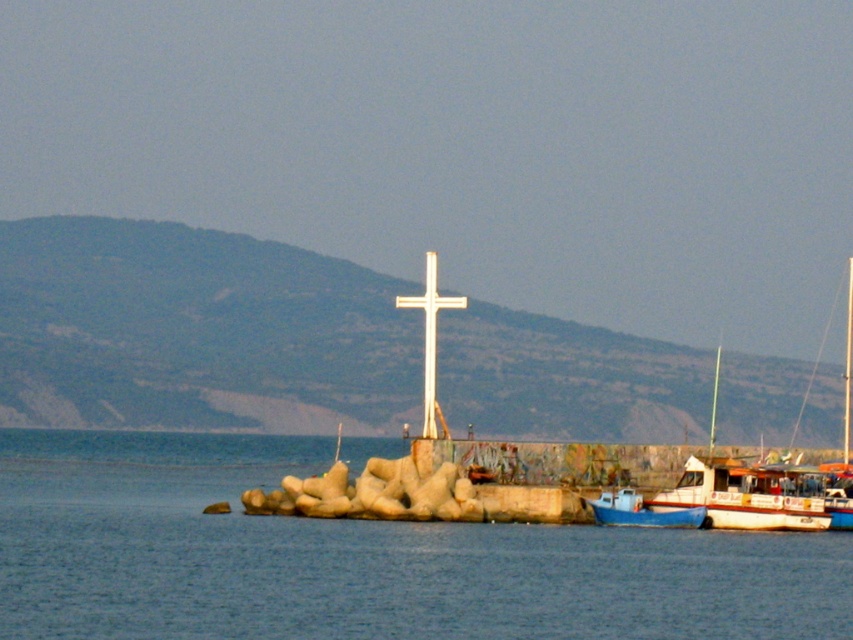
Question: Does white metallic cross at center have a smaller size compared to blue matte boat at lower right?

Choices:
 (A) yes
 (B) no

Answer: (B)

Question: Which of the following is the closest to the observer?

Choices:
 (A) (296, 456)
 (B) (705, 512)
 (C) (432, 422)

Answer: (B)

Question: Among these objects, which one is farthest from the camera?

Choices:
 (A) white metallic cross at center
 (B) white plastic boat at lower right
 (C) blue matte boat at lower right
 (D) blue water at center

Answer: (B)

Question: Is blue water at center positioned at the back of white metallic cross at center?

Choices:
 (A) no
 (B) yes

Answer: (A)

Question: Considering the real-world distances, which object is farthest from the blue water at center?

Choices:
 (A) white plastic boat at lower right
 (B) white metallic cross at center

Answer: (A)

Question: From the image, what is the correct spatial relationship of white plastic boat at lower right in relation to white metallic cross at center?

Choices:
 (A) right
 (B) left

Answer: (A)